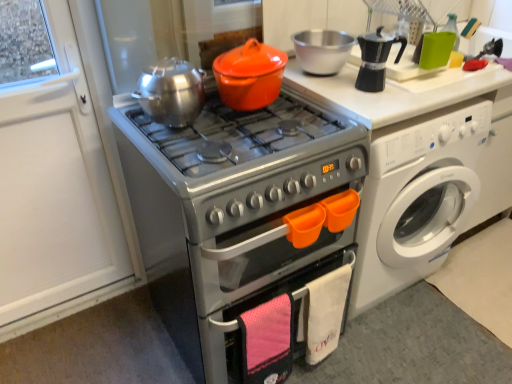
Identify the location of free space in front of orange matte crock pot at center. This screenshot has width=512, height=384. (241, 128).